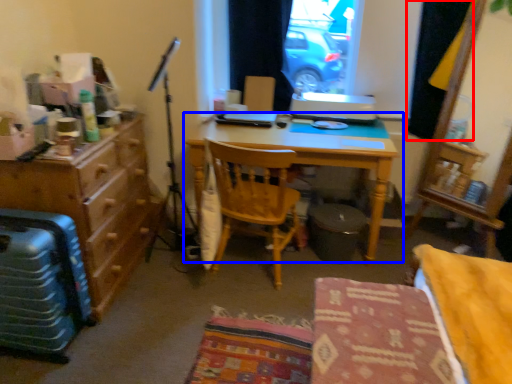
Question: Which object appears closest to the camera in this image, curtain (highlighted by a red box) or desk (highlighted by a blue box)?

Choices:
 (A) curtain
 (B) desk

Answer: (B)